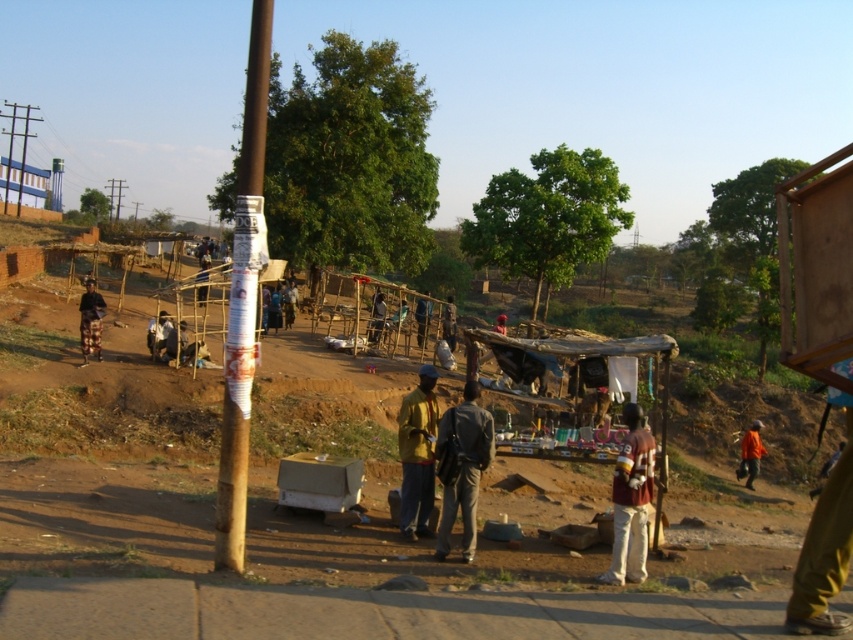
Question: Which point is closer to the camera taking this photo?

Choices:
 (A) (93, 284)
 (B) (492, 445)

Answer: (B)

Question: Among these objects, which one is nearest to the camera?

Choices:
 (A) red fabric shirt at center
 (B) maroon fabric shirt at center
 (C) yellow matte jacket at center

Answer: (B)

Question: Is maroon fabric shirt at center smaller than dark blue fabric shirt at center?

Choices:
 (A) yes
 (B) no

Answer: (B)

Question: Estimate the real-world distances between objects in this image. Which object is farther from the yellow fabric shirt at center?

Choices:
 (A) dark blue fabric shirt at center
 (B) red fabric shirt at center

Answer: (A)

Question: Can you confirm if maroon fabric shirt at center is smaller than dark blue fabric shirt at center?

Choices:
 (A) no
 (B) yes

Answer: (A)

Question: Does dark brown fabric pants at left have a greater width compared to dark brown leather jacket at center?

Choices:
 (A) yes
 (B) no

Answer: (A)